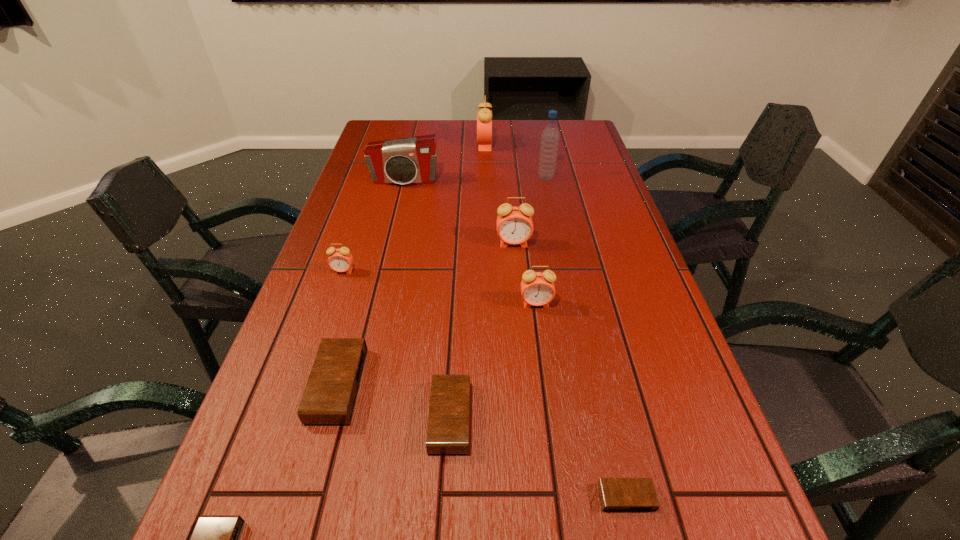
The image size is (960, 540). I want to click on the tallest object, so click(x=550, y=136).

Identify the location of water bottle. (550, 136).

This screenshot has width=960, height=540. In order to click on the farthest alarm clock in this screenshot , I will do `click(484, 116)`.

Identify the location of the farthest object. This screenshot has width=960, height=540. (484, 116).

Find the location of a particular element. This screenshot has height=540, width=960. camera is located at coordinates (412, 160).

Where is `the seventh nearest alarm clock`? The image size is (960, 540). the seventh nearest alarm clock is located at coordinates (514, 224).

At what (x,y) coordinates should I click in order to perform the action: click on the fourth farthest object. Please return your answer as a coordinate pair (x, y). The height and width of the screenshot is (540, 960). Looking at the image, I should click on (514, 224).

Identify the location of the nearest pink alarm clock. (537, 289).

Where is `the third biggest pink alarm clock`? the third biggest pink alarm clock is located at coordinates (537, 289).

Locate an element on the screen. This screenshot has height=540, width=960. the leftmost pink alarm clock is located at coordinates (340, 260).